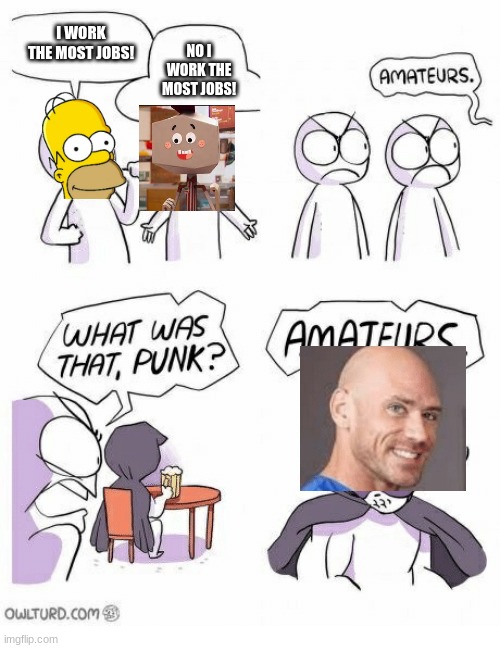
I want to click on table, so click(191, 499).